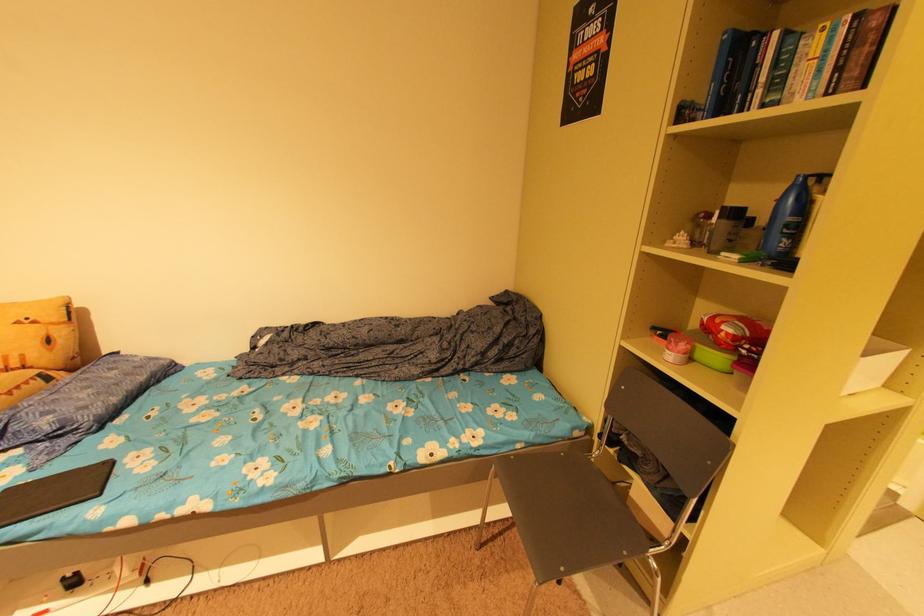
You are a GUI agent. You are given a task and a screenshot of the screen. Output one action in this format:
    pyautogui.click(x=<x>, y=<y>)
    Task: Click on the blue plastic bottle
    
    Given the screenshot: What is the action you would take?
    pyautogui.click(x=786, y=219)